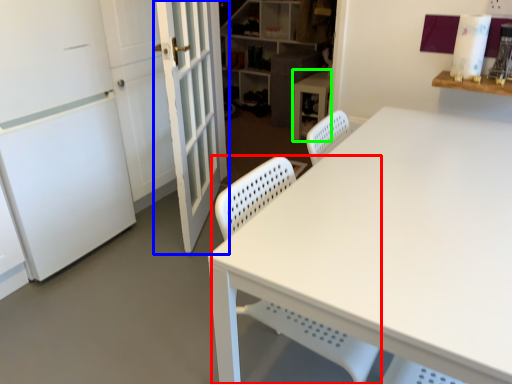
Question: Considering the real-world distances, which object is farthest from swivel chair (highlighted by a red box)? door (highlighted by a blue box) or computer desk (highlighted by a green box)?

Choices:
 (A) door
 (B) computer desk

Answer: (B)